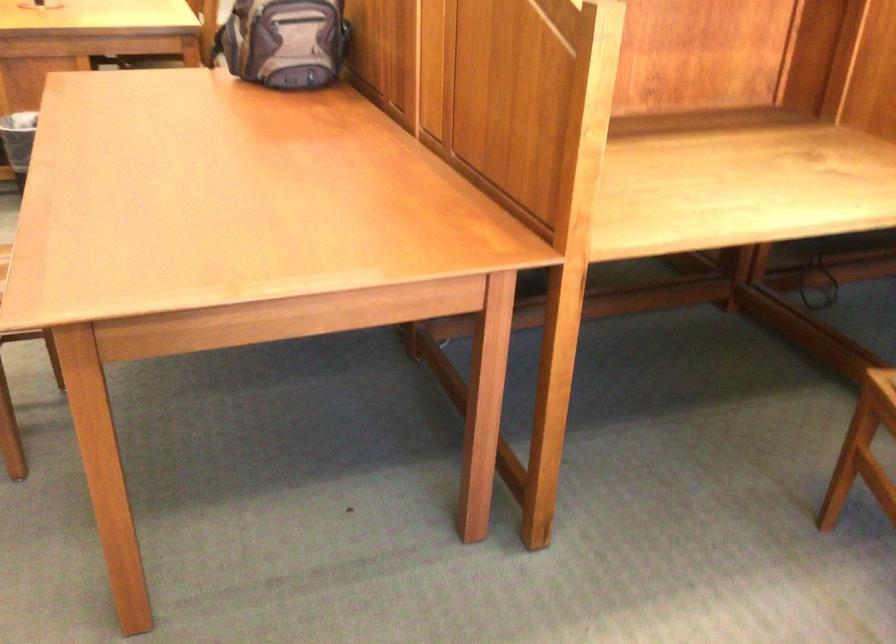
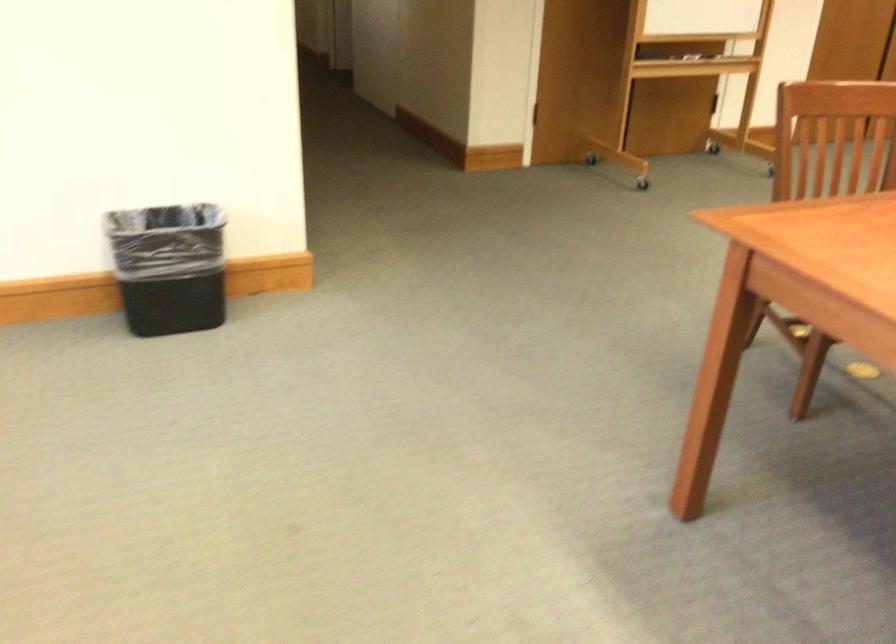
In the scene shown: The first image is from the beginning of the video and the second image is from the end. How did the camera likely rotate when shooting the video?

The camera rotated toward left-down.